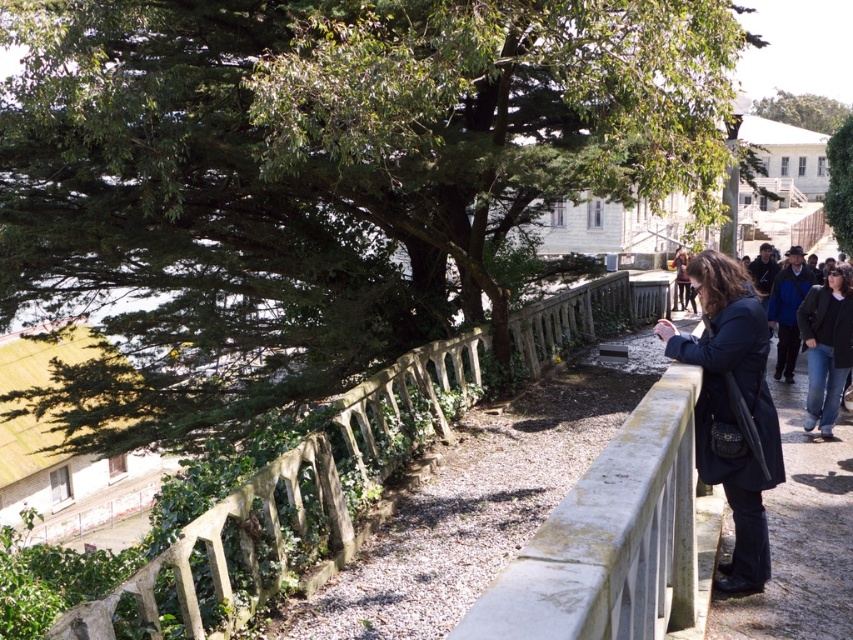
Question: Can you confirm if stone textured fence at center is thinner than dark blue coat at center?

Choices:
 (A) yes
 (B) no

Answer: (B)

Question: Which point is closer to the camera?

Choices:
 (A) green leafy tree at upper right
 (B) dark blue jeans at lower right
 (C) dark blue coat at center
 (D) green leafy tree at upper center

Answer: (C)

Question: Which is farther from the green leafy tree at upper left?

Choices:
 (A) dark blue jeans at lower right
 (B) stone textured fence at center

Answer: (A)

Question: Is dark blue coat at center below green leafy tree at upper center?

Choices:
 (A) yes
 (B) no

Answer: (A)

Question: Can you confirm if dark blue coat at center is wider than green leafy tree at upper right?

Choices:
 (A) yes
 (B) no

Answer: (B)

Question: Which point is closer to the camera?

Choices:
 (A) (817, 108)
 (B) (836, 211)

Answer: (B)